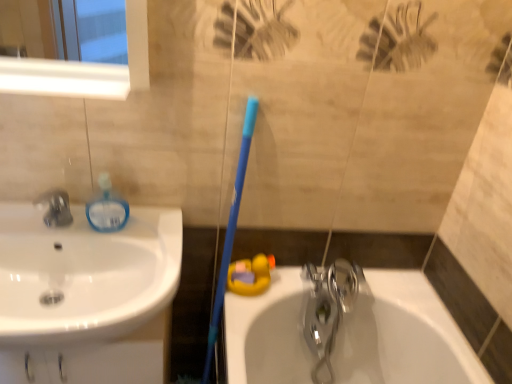
Question: In the image, is matte black faucet at left, which ranks as the second tap in bottom-to-top order, positioned in front of or behind white glossy sink at left?

Choices:
 (A) behind
 (B) front

Answer: (A)

Question: From the image's perspective, is matte black faucet at left, which ranks as the second tap in bottom-to-top order, located above or below white glossy sink at left?

Choices:
 (A) above
 (B) below

Answer: (A)

Question: Which is farther from the polished chrome faucet at lower center, arranged as the 1th tap when viewed from the right?

Choices:
 (A) matte black faucet at left, positioned as the second tap in right-to-left order
 (B) blue plastic toothbrush at center
 (C) white glossy sink at left

Answer: (A)

Question: Based on their relative distances, which object is nearer to the white glossy sink at left?

Choices:
 (A) polished chrome faucet at lower center, arranged as the first tap when viewed from the back
 (B) matte black faucet at left, the 2th tap from the back
 (C) blue plastic toothbrush at center

Answer: (B)